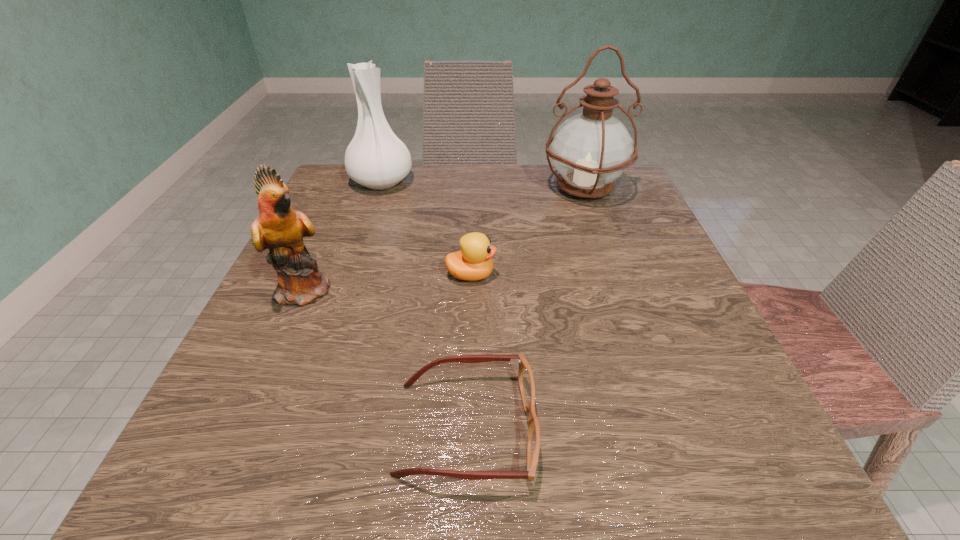
The height and width of the screenshot is (540, 960). I want to click on free space located on the face of the fourth tallest object, so click(x=622, y=275).

Locate an element on the screen. The width and height of the screenshot is (960, 540). blank area located on the front-facing side of the shortest object is located at coordinates (588, 429).

In order to click on oil lamp present at the far edge in this screenshot , I will do `click(590, 150)`.

The height and width of the screenshot is (540, 960). Find the location of `vase located at the far edge`. vase located at the far edge is located at coordinates (376, 158).

This screenshot has width=960, height=540. I want to click on object that is at the near edge, so click(526, 383).

Find the location of `vase that is positioned at the left edge`. vase that is positioned at the left edge is located at coordinates (376, 158).

At what (x,y) coordinates should I click in order to perform the action: click on parrot located in the left edge section of the desktop. Please return your answer as a coordinate pair (x, y). Image resolution: width=960 pixels, height=540 pixels. Looking at the image, I should click on (279, 228).

Identify the location of object that is at the right edge. (590, 150).

Where is `object at the far left corner`? object at the far left corner is located at coordinates (376, 158).

Where is `object located in the far right corner section of the desktop`? The image size is (960, 540). object located in the far right corner section of the desktop is located at coordinates (590, 150).